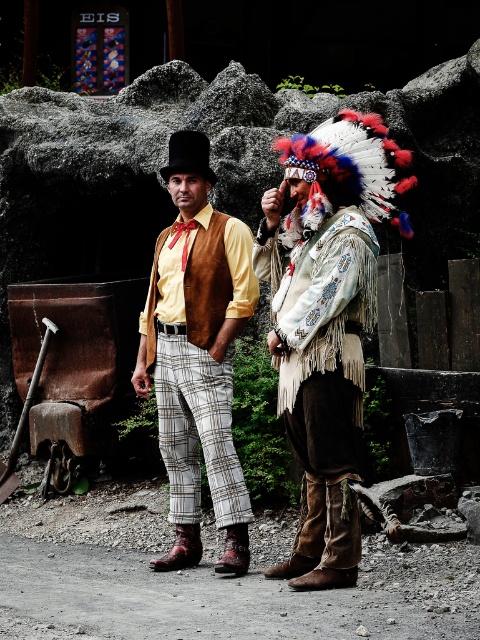
Does point (312, 332) come behind point (212, 304)?

No.

Where is `white fringed leather jacket at center`? The width and height of the screenshot is (480, 640). white fringed leather jacket at center is located at coordinates (325, 323).

Find the location of a particular element. The width and height of the screenshot is (480, 640). white fringed leather jacket at center is located at coordinates (325, 323).